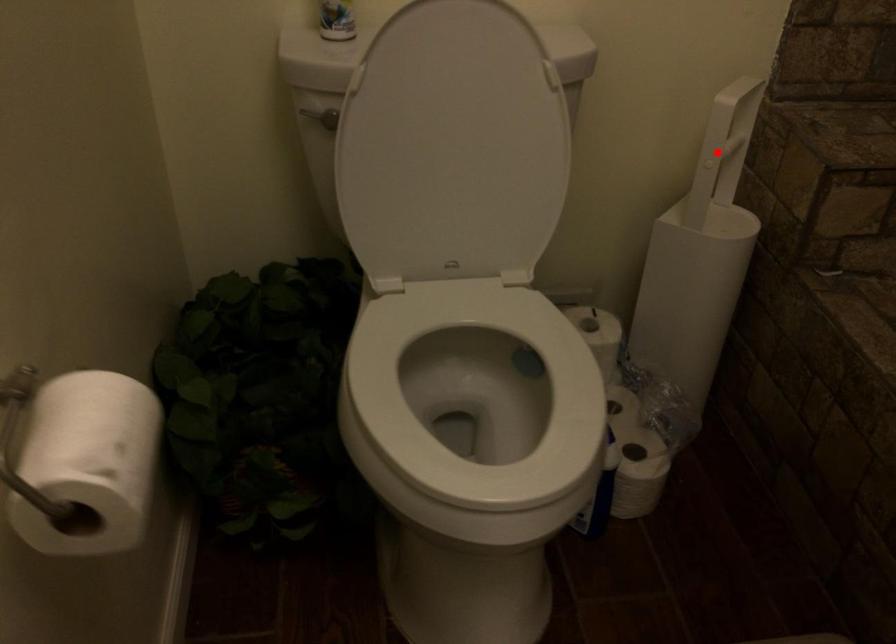
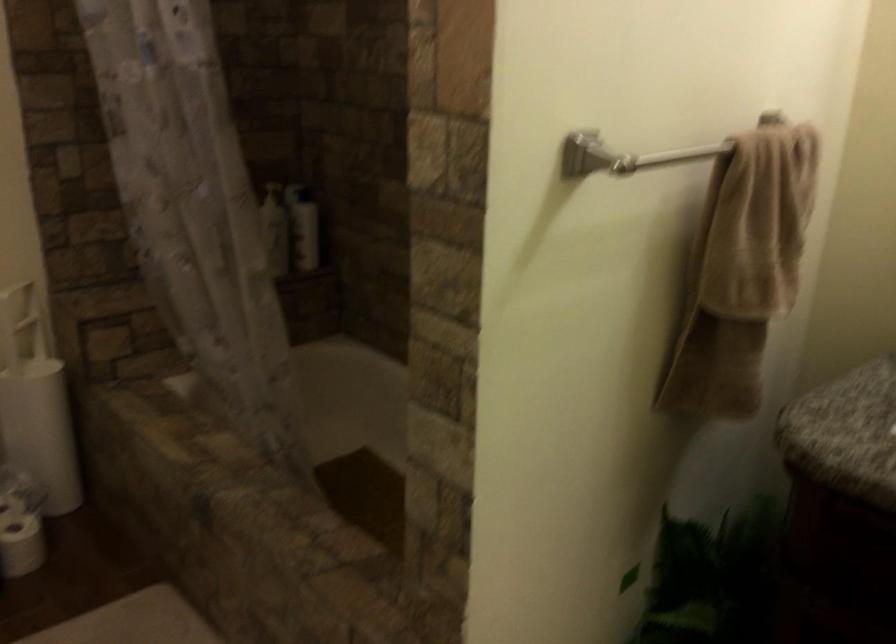
Question: I am providing you with two images of the same scene from different viewpoints. Given a red point in image1, look at the same physical point in image2. Is it:

Choices:
 (A) Closer to the viewpoint
 (B) Farther from the viewpoint

Answer: (B)